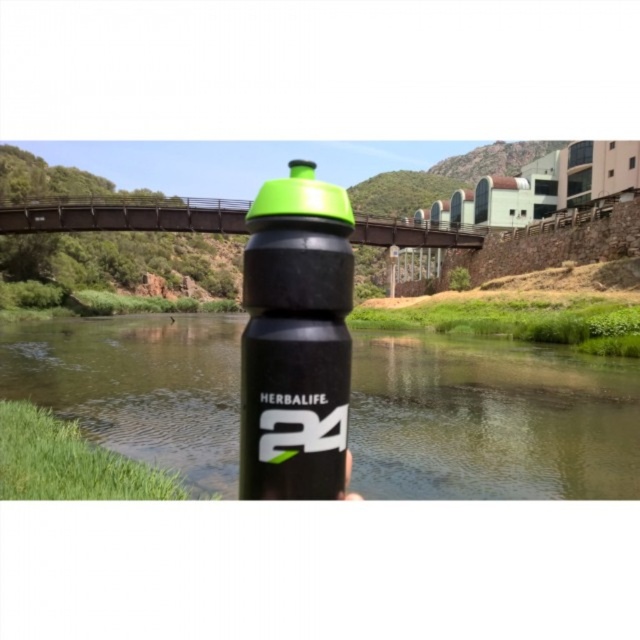
Question: Can you confirm if green matte water at center is positioned below matte black bottle at center?

Choices:
 (A) no
 (B) yes

Answer: (A)

Question: Can you confirm if green matte water at center is thinner than matte black bottle at center?

Choices:
 (A) yes
 (B) no

Answer: (B)

Question: Which object is closer to the camera taking this photo?

Choices:
 (A) green matte water at center
 (B) matte black bottle at center

Answer: (B)

Question: Can you confirm if green matte water at center is positioned below matte black bottle at center?

Choices:
 (A) yes
 (B) no

Answer: (B)

Question: Which of the following is the farthest from the observer?

Choices:
 (A) (42, 392)
 (B) (289, 294)

Answer: (A)